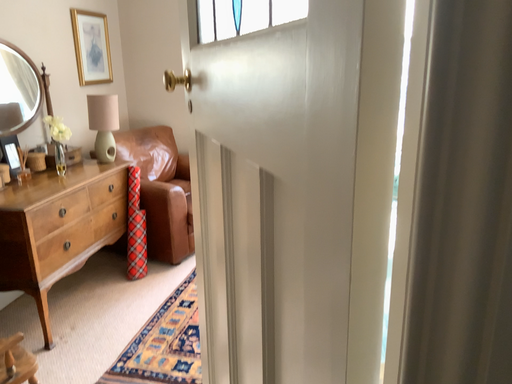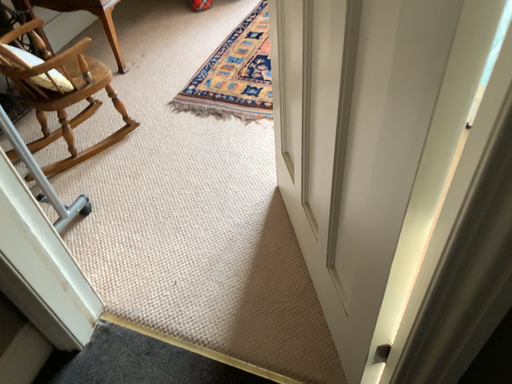
Question: How did the camera likely rotate when shooting the video?

Choices:
 (A) rotated right
 (B) rotated left

Answer: (B)